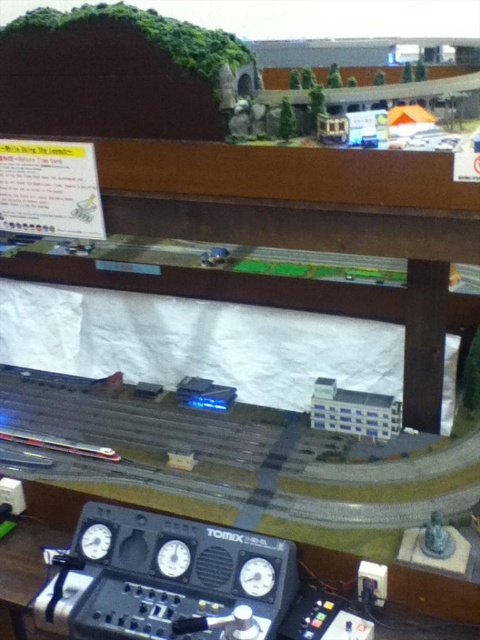
Question: Which point is farther to the camera?

Choices:
 (A) (256, 563)
 (B) (96, 545)
 (C) (166, 563)
 (D) (396, 403)

Answer: (D)

Question: Where is white plastic building at center located in relation to matte black gauge at bottom center in the image?

Choices:
 (A) right
 (B) left

Answer: (A)

Question: Is matte black gauge at bottom center behind matte black gauge at center?

Choices:
 (A) yes
 (B) no

Answer: (B)

Question: Which point is closer to the camera?

Choices:
 (A) matte black gauge at bottom center
 (B) matte black gauge at center
 (C) matte black gauge at lower left

Answer: (A)

Question: Which object is positioned closest to the matte black gauge at center?

Choices:
 (A) matte black gauge at lower left
 (B) white plastic building at center

Answer: (A)

Question: Is matte black gauge at bottom center bigger than matte black gauge at center?

Choices:
 (A) no
 (B) yes

Answer: (B)